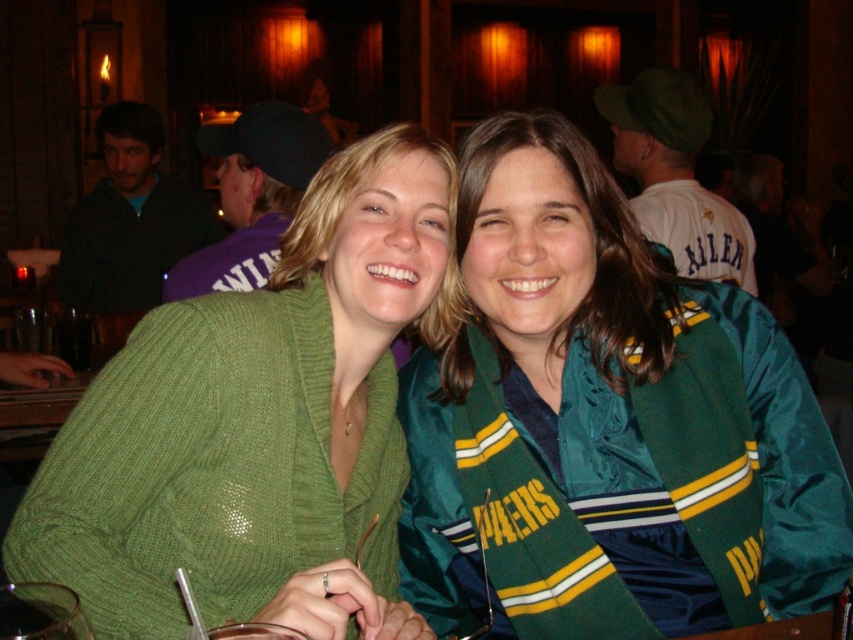
Question: Which point is closer to the camera taking this photo?

Choices:
 (A) (602, 209)
 (B) (299, 374)

Answer: (B)

Question: Is green satin jacket at center wider than green knitted sweater at center?

Choices:
 (A) yes
 (B) no

Answer: (A)

Question: Is green satin jacket at center closer to the viewer compared to green knitted sweater at center?

Choices:
 (A) no
 (B) yes

Answer: (A)

Question: Is green satin jacket at center above green knitted sweater at center?

Choices:
 (A) no
 (B) yes

Answer: (B)

Question: Which object is closer to the camera taking this photo?

Choices:
 (A) green satin jacket at center
 (B) green knitted sweater at center

Answer: (B)

Question: Which point is closer to the camera?

Choices:
 (A) (219, 564)
 (B) (578, 628)

Answer: (A)